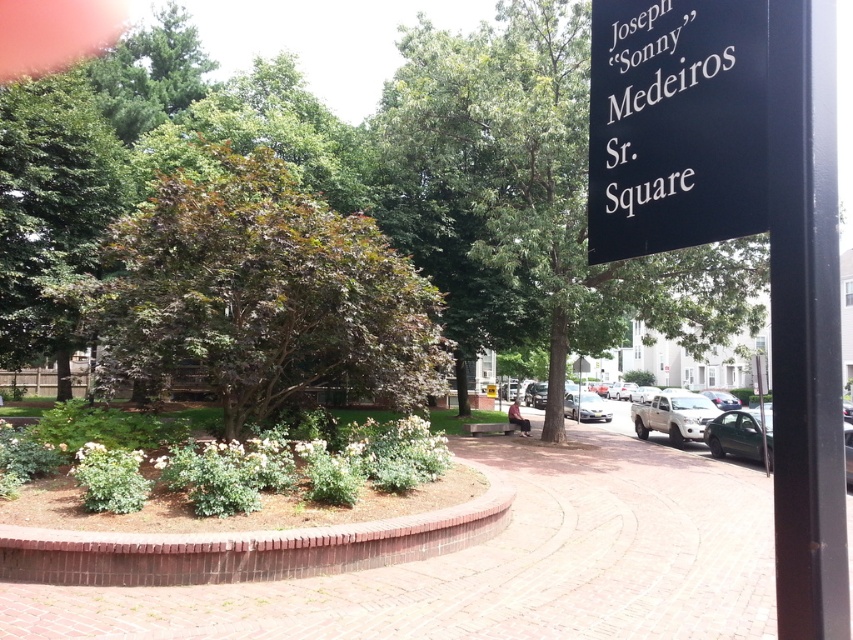
You are standing in the park and see two points marked in the image. Which point is closer to you, point (688, 182) or point (822, 310)?

Point (688, 182) is further to the viewer than point (822, 310), so point (822, 310) is closer to you.

You are standing at point (532,193) in the park. What is the nearest object to you?

The nearest object to you at point (532,193) is the green leafy tree at center.

You are a city planner reviewing the layout of Joseph Medeiros Sr. Square. You need to place a new bench in the park such that it is exactly 1.5 meters away from the green leafy tree at center. Where should you place the bench relative to the tree?

The bench should be placed 1.5 meters away from the green leafy tree at center. Since the tree is located at coordinates point (532, 193), the bench can be positioned either to the north, south, east, or west of the tree, maintaining the 1.5 meter distance.